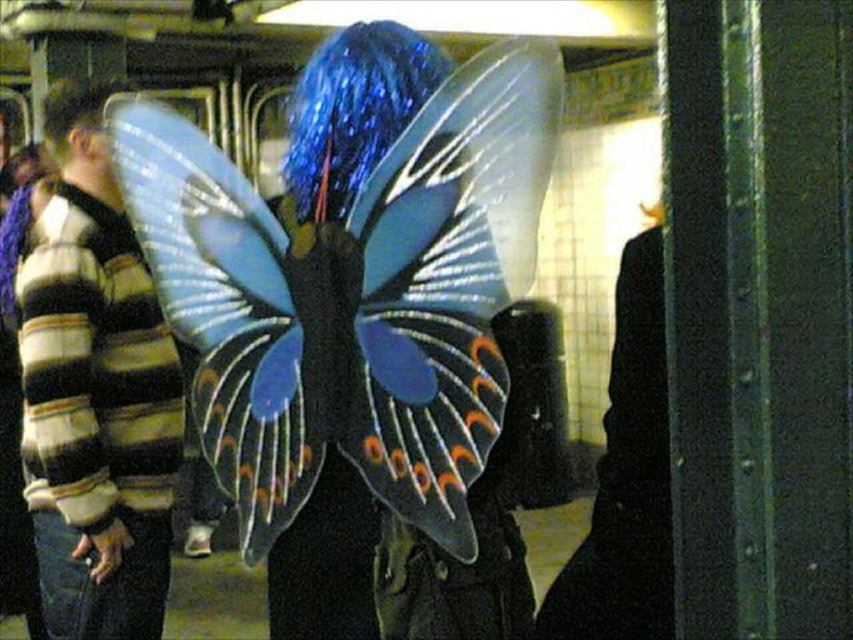
Question: Estimate the real-world distances between objects in this image. Which object is closer to the striped wool sweater at left?

Choices:
 (A) translucent plastic butterfly at center
 (B) blue glittery hair at upper left

Answer: (B)

Question: Estimate the real-world distances between objects in this image. Which object is closer to the blue glittery hair at upper left?

Choices:
 (A) translucent plastic butterfly at center
 (B) striped wool sweater at left
 (C) shiny blue hair at center

Answer: (B)

Question: Is striped wool sweater at left behind blue glittery hair at upper left?

Choices:
 (A) yes
 (B) no

Answer: (B)

Question: Where is striped wool sweater at left located in relation to shiny blue hair at center in the image?

Choices:
 (A) above
 (B) below

Answer: (B)

Question: Can you confirm if shiny blue hair at center is smaller than blue glittery hair at upper left?

Choices:
 (A) yes
 (B) no

Answer: (B)

Question: Which point is farther from the camera taking this photo?

Choices:
 (A) (160, 500)
 (B) (473, 122)
 (C) (364, 22)

Answer: (A)